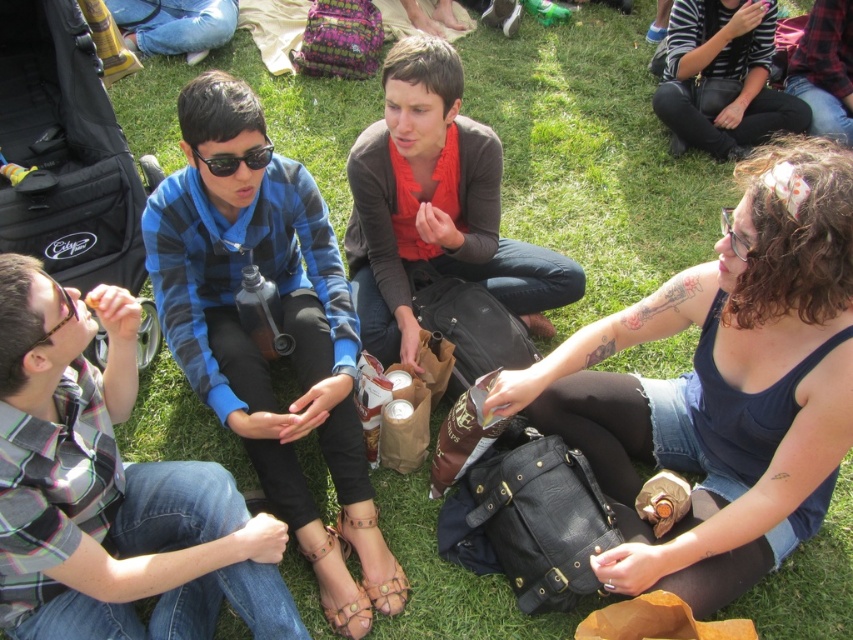
Question: Does dark gray sweater at center have a larger size compared to tan leather sandal at lower center?

Choices:
 (A) yes
 (B) no

Answer: (A)

Question: Which object is positioned farthest from the dark gray sweater at center?

Choices:
 (A) blue plaid shirt at center
 (B) tan leather sandal at lower center
 (C) clear plastic goggles at upper center
 (D) plaid shirt at left

Answer: (C)

Question: Which of the following is the closest to the observer?

Choices:
 (A) matte black goggles at upper left
 (B) dark gray sweater at center

Answer: (A)

Question: Where is plaid shirt at left located in relation to dark gray sweater at center in the image?

Choices:
 (A) right
 (B) left

Answer: (B)

Question: Which point appears closest to the camera in this image?

Choices:
 (A) (201, 8)
 (B) (766, 72)

Answer: (B)

Question: Does dark gray sweater at center have a larger size compared to brown leather sandal at lower center?

Choices:
 (A) yes
 (B) no

Answer: (A)